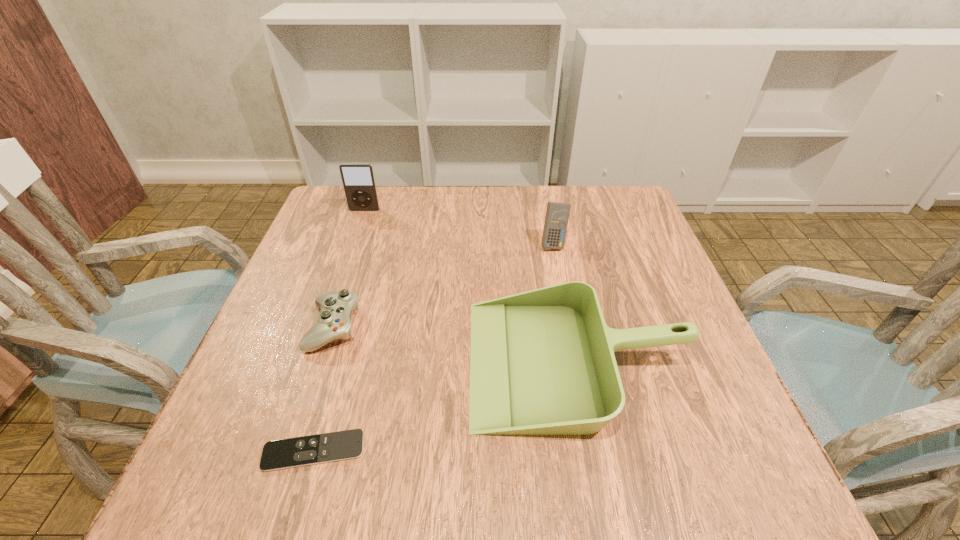
In order to click on vacant space that's between the calculator and the second shortest object in this screenshot , I will do `click(444, 286)`.

You are a GUI agent. You are given a task and a screenshot of the screen. Output one action in this format:
    pyautogui.click(x=<x>, y=<y>)
    Task: Click on the unoccupied area between the control and the farthest object
    
    Given the screenshot: What is the action you would take?
    pyautogui.click(x=349, y=268)

The height and width of the screenshot is (540, 960). What are the coordinates of `empty location between the third tallest object and the iPod` in the screenshot? It's located at tap(471, 286).

Identify which object is the second closest to the dustpan. Please provide its 2D coordinates. Your answer should be formatted as a tuple, i.e. [(x, y)], where the tuple contains the x and y coordinates of a point satisfying the conditions above.

[(314, 449)]

Locate an element on the screen. This screenshot has height=540, width=960. the fourth closest object relative to the calculator is located at coordinates (314, 449).

The width and height of the screenshot is (960, 540). Identify the location of blank space that satisfies the following two spatial constraints: 1. on the front-facing side of the remote control; 2. on the left side of the tallest object. (281, 451).